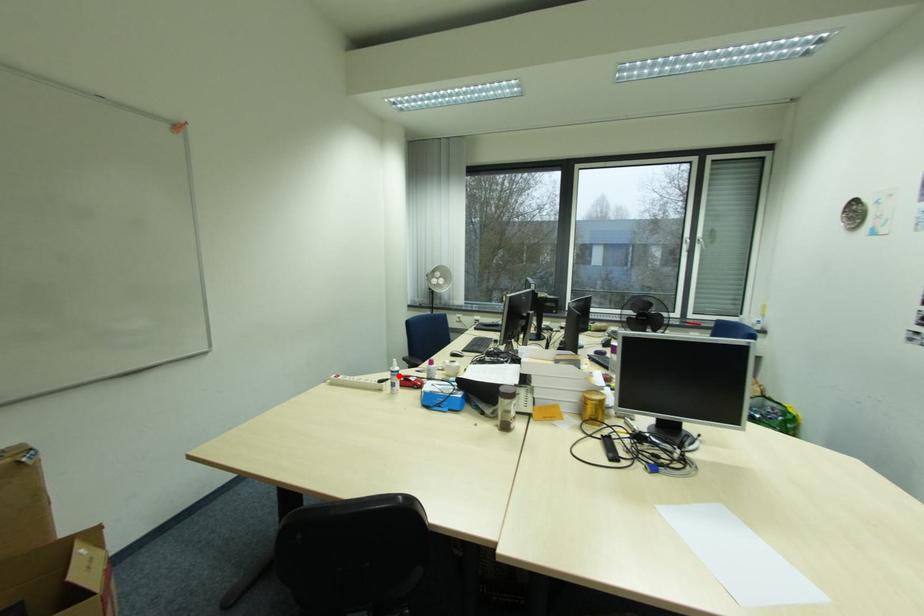
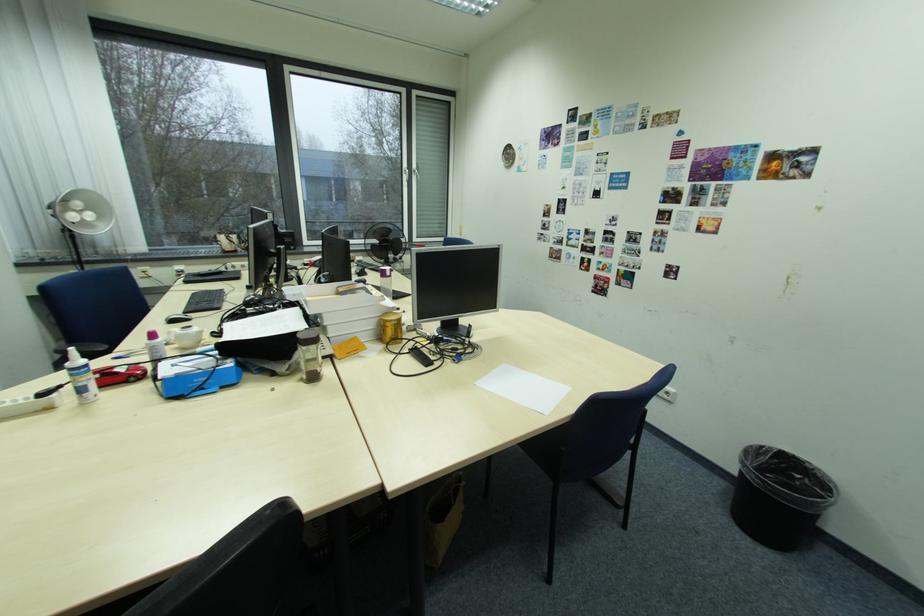
Question: I am providing you with two images of the same scene from different viewpoints. In image1, a red point is highlighted. Considering the same 3D point in image2, which of the following is correct?

Choices:
 (A) It is closer
 (B) It is farther

Answer: (B)